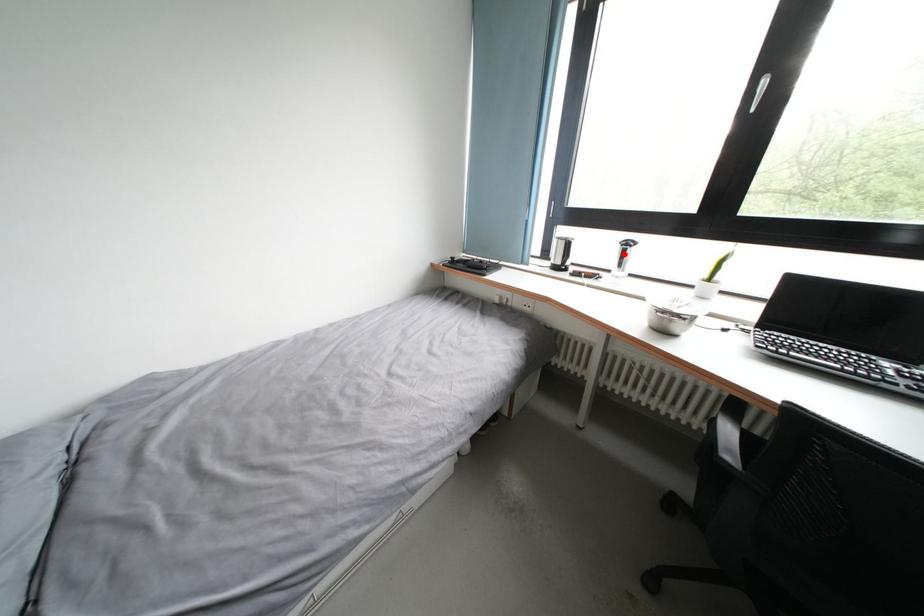
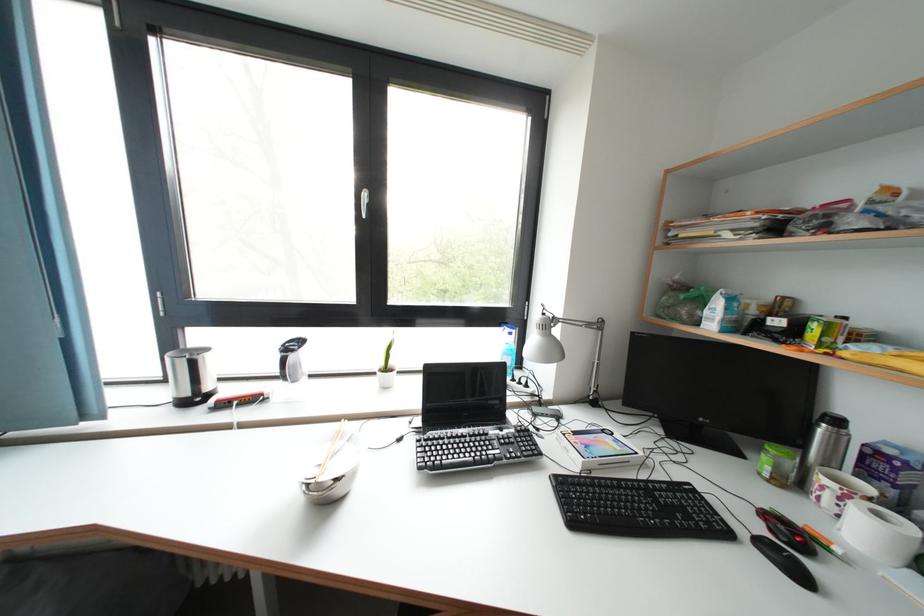
Question: A red point is marked in image1. In image2, is the corresponding 3D point closer to the camera or farther? Reply with the corresponding letter.

Choices:
 (A) The corresponding 3D point is closer.
 (B) The corresponding 3D point is farther.

Answer: (B)